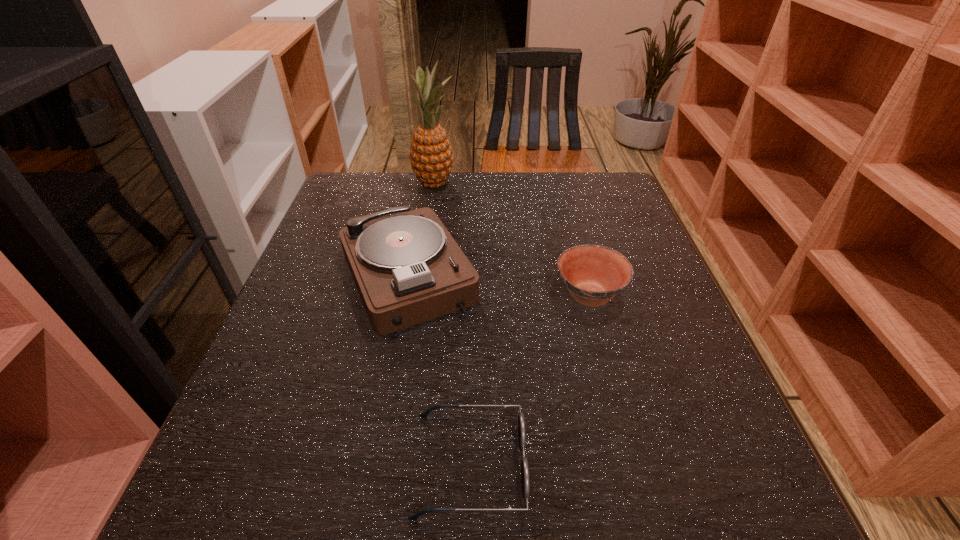
The width and height of the screenshot is (960, 540). I want to click on free space that satisfies the following two spatial constraints: 1. on the back side of the pineapple; 2. on the right side of the third shortest object, so click(x=425, y=184).